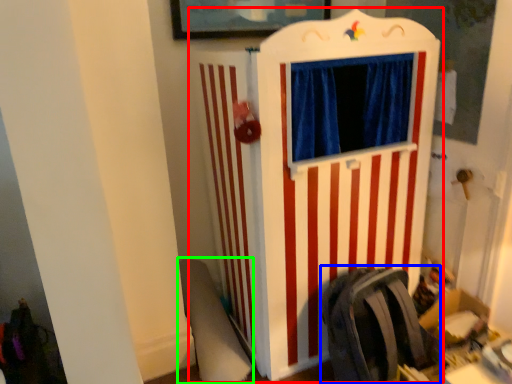
Question: Which object is the closest to the furniture (highlighted by a red box)? Choose among these: folding chair (highlighted by a blue box) or swivel chair (highlighted by a green box).

Choices:
 (A) folding chair
 (B) swivel chair

Answer: (A)